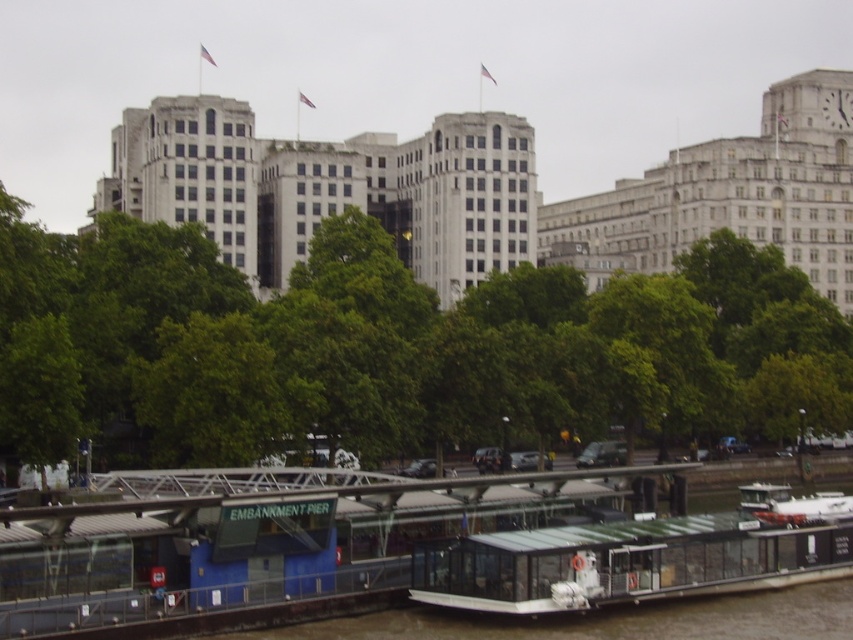
Is green leafy tree at center to the right of transparent glass boat at center from the viewer's perspective?

Incorrect, green leafy tree at center is not on the right side of transparent glass boat at center.

Is green leafy tree at center further to the viewer compared to transparent glass boat at center?

Yes, green leafy tree at center is further from the viewer.

The image size is (853, 640). In order to click on green leafy tree at center in this screenshot , I will do `click(390, 349)`.

Where is `green leafy tree at center`? The width and height of the screenshot is (853, 640). green leafy tree at center is located at coordinates (390, 349).